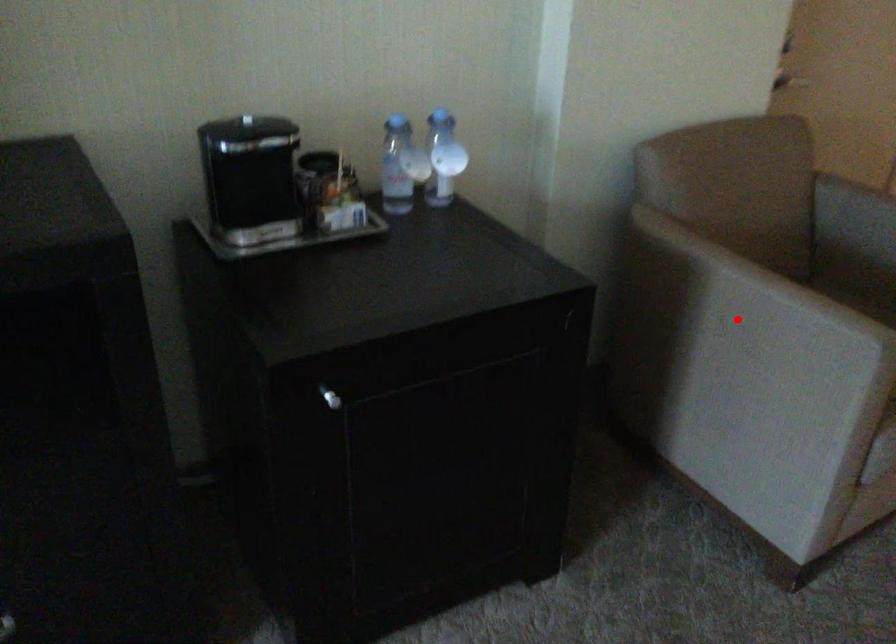
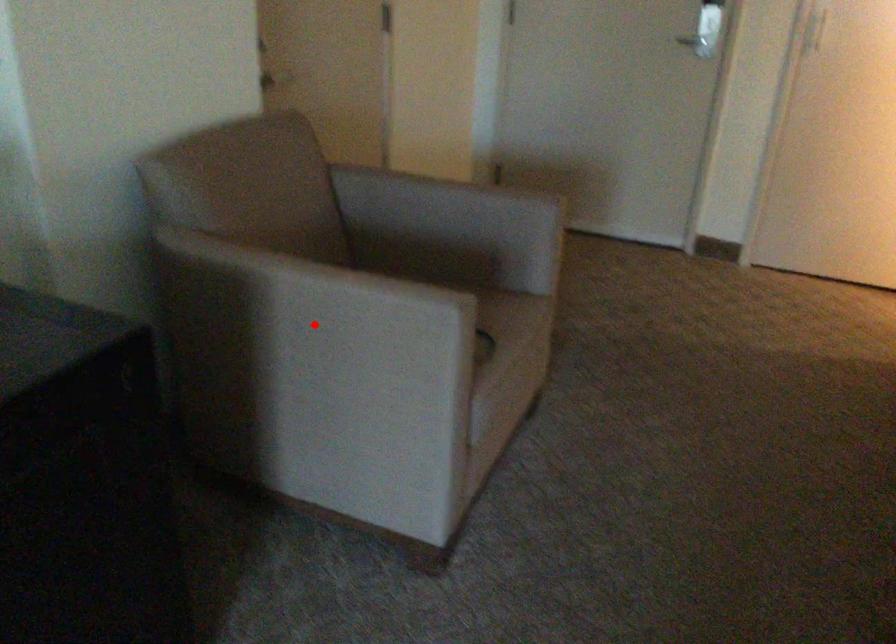
I am providing you with two images of the same scene from different viewpoints. A red point is marked on the first image and another point is marked on the second image. Are the points marked in image1 and image2 representing the same 3D position?

Yes